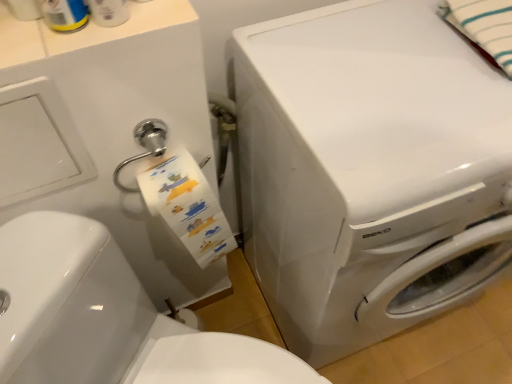
What do you see at coordinates (369, 171) in the screenshot? The image size is (512, 384). I see `white glossy washing machine at center` at bounding box center [369, 171].

What are the coordinates of `white striped fabric at upper right` in the screenshot? It's located at (484, 26).

Identify the location of white glossy washing machine at center. (369, 171).

Considering the relative positions of white glossy washer at center and white glossy washing machine at center in the image provided, is white glossy washer at center to the left of white glossy washing machine at center from the viewer's perspective?

Indeed, white glossy washer at center is positioned on the left side of white glossy washing machine at center.

Is white glossy washer at center not close to white glossy washing machine at center?

white glossy washer at center is actually quite close to white glossy washing machine at center.

Looking at this image, between white glossy washer at center and white glossy washing machine at center, which one has smaller size?

With smaller size is white glossy washer at center.

Is white glossy washer at center inside or outside of white glossy washing machine at center?

white glossy washer at center is not inside white glossy washing machine at center, it's outside.

Could you tell me if white glossy washing machine at center is turned towards white striped fabric at upper right?

No, white glossy washing machine at center is not turned towards white striped fabric at upper right.

Consider the image. Are white glossy washing machine at center and white striped fabric at upper right located far from each other?

No.

Considering the sizes of white glossy washing machine at center and white striped fabric at upper right in the image, is white glossy washing machine at center taller or shorter than white striped fabric at upper right?

Considering their sizes, white glossy washing machine at center has more height than white striped fabric at upper right.

From a real-world perspective, which is physically below, white glossy washing machine at center or white striped fabric at upper right?

white glossy washing machine at center.

From a real-world perspective, which is physically below, white striped fabric at upper right or white glossy washer at center?

In real-world perspective, white glossy washer at center is lower.

From the image's perspective, is white striped fabric at upper right positioned above or below white glossy washer at center?

white striped fabric at upper right is situated higher than white glossy washer at center in the image.

Can you confirm if white striped fabric at upper right is thinner than white glossy washer at center?

Indeed, white striped fabric at upper right has a lesser width compared to white glossy washer at center.

Considering the positions of objects white glossy washing machine at center and white glossy washer at center in the image provided, who is more to the right, white glossy washing machine at center or white glossy washer at center?

From the viewer's perspective, white glossy washing machine at center appears more on the right side.

Would you consider white glossy washing machine at center to be distant from white glossy washer at center?

That's not correct — white glossy washing machine at center is a little close to white glossy washer at center.

Would you say white glossy washing machine at center is inside or outside white glossy washer at center?

white glossy washing machine at center exists outside the volume of white glossy washer at center.

Between white glossy washing machine at center and white glossy washer at center, which one has more height?

white glossy washing machine at center.

Which point is more forward, (282, 381) or (507, 52)?

Point (507, 52)

From a real-world perspective, is white glossy washer at center below white striped fabric at upper right?

Yes, from a real-world perspective, white glossy washer at center is under white striped fabric at upper right.

Considering the relative sizes of white glossy washer at center and white striped fabric at upper right in the image provided, is white glossy washer at center smaller than white striped fabric at upper right?

Incorrect, white glossy washer at center is not smaller in size than white striped fabric at upper right.

Based on their sizes in the image, would you say white striped fabric at upper right is bigger or smaller than white glossy washing machine at center?

Considering their sizes, white striped fabric at upper right takes up less space than white glossy washing machine at center.

How different are the orientations of white striped fabric at upper right and white glossy washing machine at center in degrees?

The angular difference between white striped fabric at upper right and white glossy washing machine at center is 0.000506 degrees.

From a real-world perspective, is white striped fabric at upper right positioned above or below white glossy washing machine at center?

From a real-world perspective, white striped fabric at upper right is physically above white glossy washing machine at center.

Does white striped fabric at upper right touch white glossy washing machine at center?

white striped fabric at upper right and white glossy washing machine at center are clearly separated.

This screenshot has height=384, width=512. In order to click on washing machine above the white glossy washer at center (from the image's perspective) in this screenshot , I will do `click(369, 171)`.

Locate an element on the screen. This screenshot has height=384, width=512. washing machine below the white striped fabric at upper right (from the image's perspective) is located at coordinates (369, 171).

Looking at the image, which one is located further to white striped fabric at upper right, white glossy washer at center or white glossy washing machine at center?

white glossy washer at center is positioned further to the anchor white striped fabric at upper right.

Which object lies further to the anchor point white glossy washing machine at center, white glossy washer at center or white striped fabric at upper right?

white glossy washer at center.

Which object lies further to the anchor point white glossy washer at center, white striped fabric at upper right or white glossy washing machine at center?

white striped fabric at upper right lies further to white glossy washer at center than the other object.

Considering their positions, is white glossy washing machine at center positioned closer to white striped fabric at upper right than white glossy washer at center?

white glossy washing machine at center is positioned closer to the anchor white striped fabric at upper right.

Looking at this image, when comparing their distances from white glossy washer at center, does white glossy washing machine at center or white striped fabric at upper right seem further?

white striped fabric at upper right lies further to white glossy washer at center than the other object.

Looking at the image, which one is located further to white glossy washing machine at center, white striped fabric at upper right or white glossy washer at center?

white glossy washer at center.

The height and width of the screenshot is (384, 512). I want to click on washing machine between white striped fabric at upper right and white glossy washer at center vertically, so click(x=369, y=171).